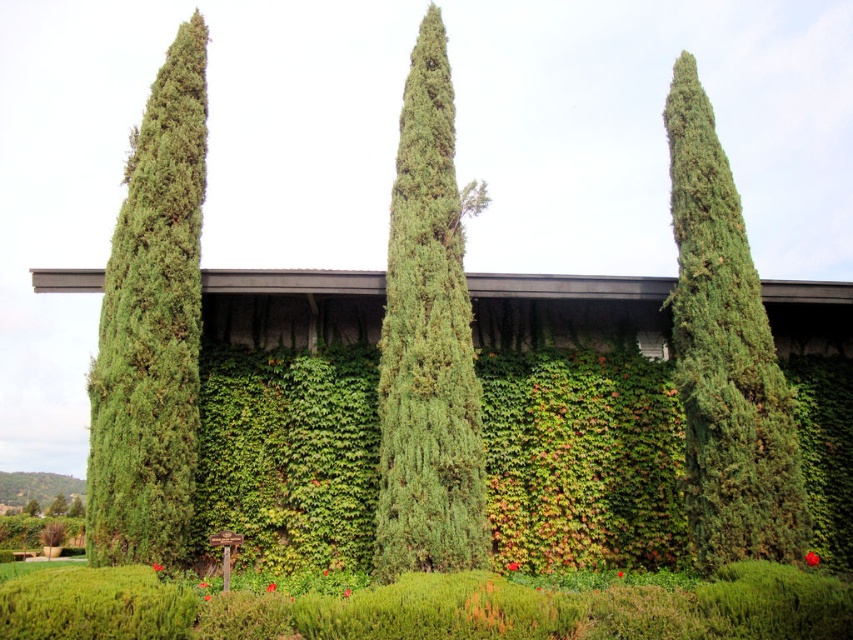
Question: Is green textured tree at center smaller than green textured tree at right?

Choices:
 (A) yes
 (B) no

Answer: (B)

Question: Which point is closer to the camera taking this photo?

Choices:
 (A) (451, 445)
 (B) (196, 218)
 (C) (705, 512)

Answer: (A)

Question: Which point appears farthest from the camera in this image?

Choices:
 (A) (701, 305)
 (B) (148, 518)
 (C) (398, 260)
 (D) (50, 513)

Answer: (D)

Question: Does green textured tree at left have a smaller size compared to green leafy tree at center?

Choices:
 (A) no
 (B) yes

Answer: (B)

Question: Is green textured tree at left wider than green textured tree at center?

Choices:
 (A) no
 (B) yes

Answer: (A)

Question: Which point appears farthest from the camera in this image?

Choices:
 (A) (54, 515)
 (B) (689, 120)
 (C) (450, 538)

Answer: (A)